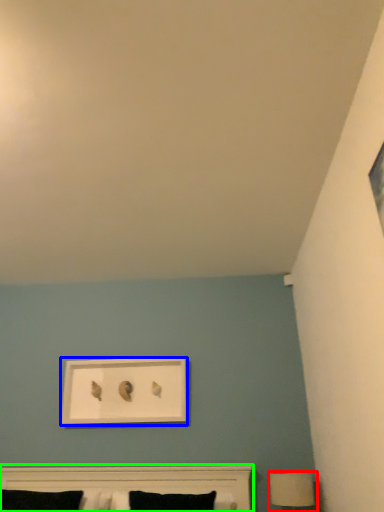
Question: Considering the real-world distances, which object is farthest from table lamp (highlighted by a red box)? picture frame (highlighted by a blue box) or bed (highlighted by a green box)?

Choices:
 (A) picture frame
 (B) bed

Answer: (A)